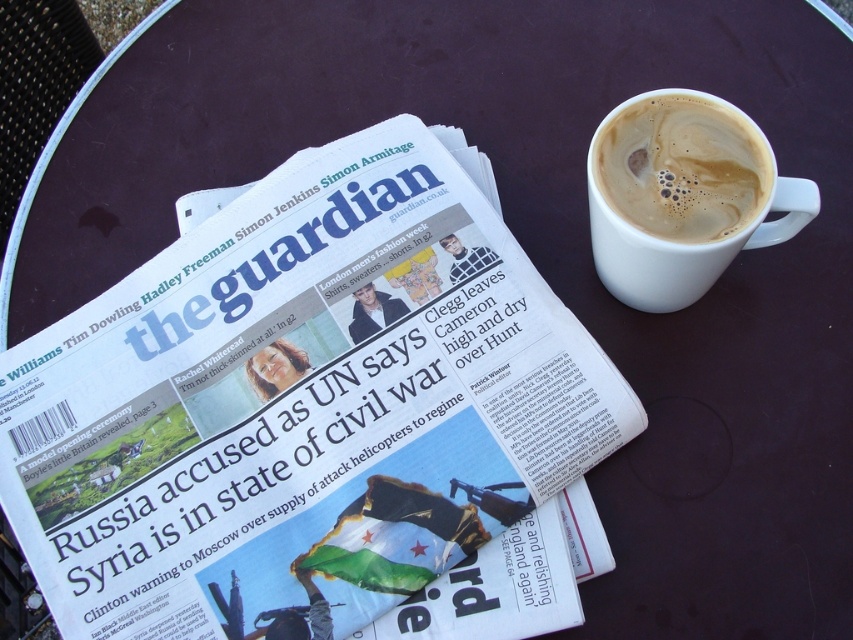
Question: Can you confirm if white glossy cup at upper right is wider than white frothy coffee at upper right?

Choices:
 (A) no
 (B) yes

Answer: (B)

Question: Which object is the farthest from the white frothy coffee at upper right?

Choices:
 (A) white ceramic mug at upper right
 (B) white glossy cup at upper right

Answer: (B)

Question: Which point is farther from the camera taking this photo?

Choices:
 (A) (816, 208)
 (B) (717, 148)
 (C) (113, 378)

Answer: (C)

Question: Where is white glossy cup at upper right located in relation to white frothy coffee at upper right in the image?

Choices:
 (A) left
 (B) right

Answer: (A)

Question: Where is white ceramic mug at upper right located in relation to white frothy coffee at upper right in the image?

Choices:
 (A) below
 (B) above

Answer: (A)

Question: Among these objects, which one is nearest to the camera?

Choices:
 (A) white frothy coffee at upper right
 (B) white glossy cup at upper right

Answer: (A)